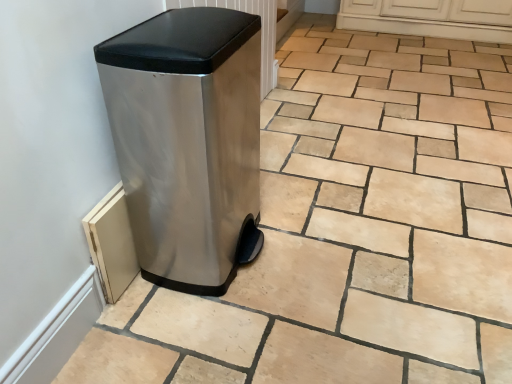
Find the location of `stainless steel trash can at left`. stainless steel trash can at left is located at coordinates (188, 142).

Measure the distance between point (243, 174) and camera.

Point (243, 174) is 5.55 feet away from camera.

Describe the element at coordinates (188, 142) in the screenshot. The image size is (512, 384). I see `stainless steel trash can at left` at that location.

The image size is (512, 384). I want to click on stainless steel trash can at left, so tap(188, 142).